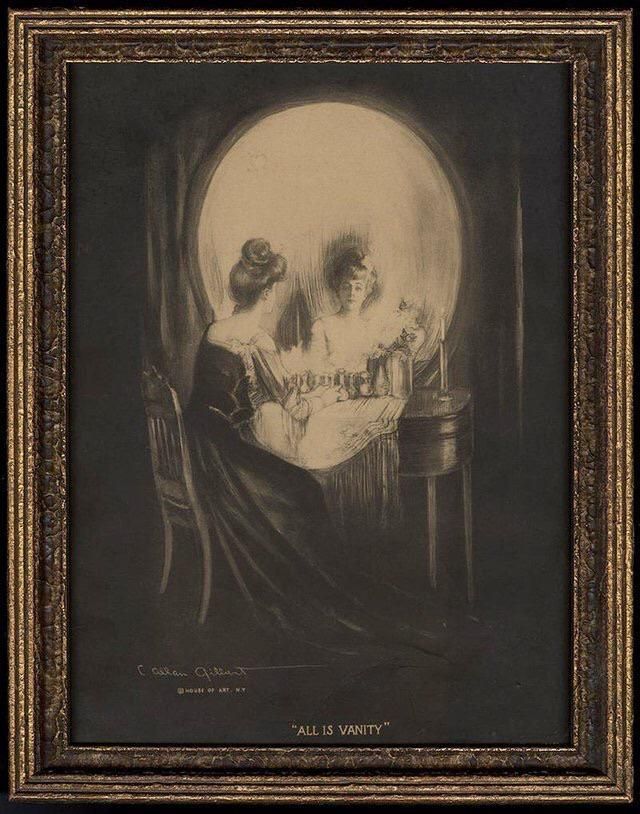
At what (x,y) coordinates should I click in order to perform the action: click on table. Please return your answer as a coordinate pair (x, y). The width and height of the screenshot is (640, 814). Looking at the image, I should click on (444, 445).